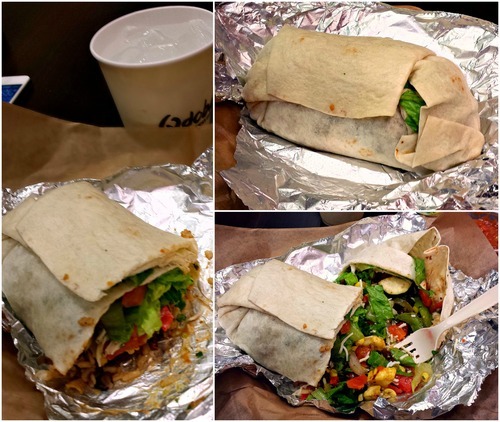
The width and height of the screenshot is (500, 422). Identify the location of writing on cup. (189, 115).